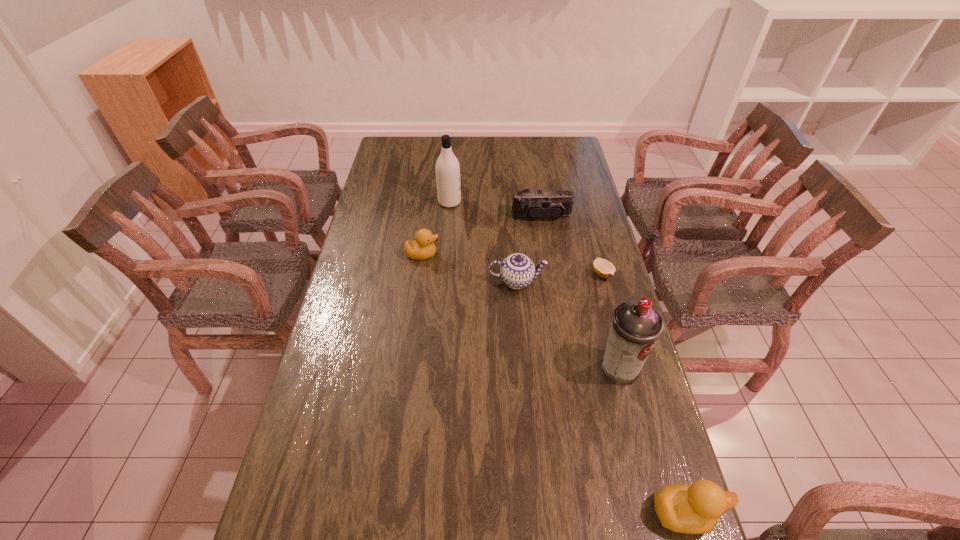
To make them evenly spaced by inserting another duckling among them, please locate a vacant spot for this new duckling. Please provide its 2D coordinates. Your answer should be formatted as a tuple, i.e. [(x, y)], where the tuple contains the x and y coordinates of a point satisfying the conditions above.

[(523, 354)]